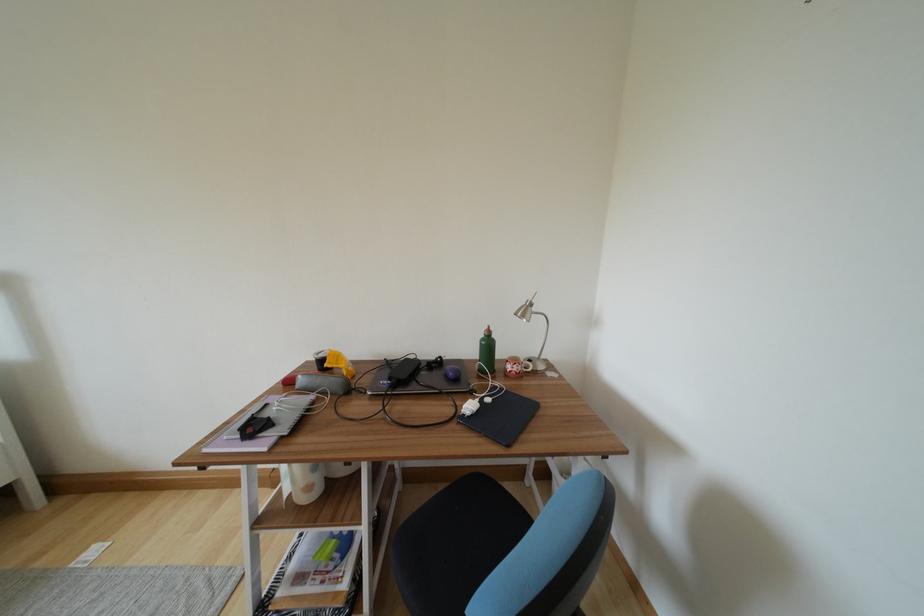
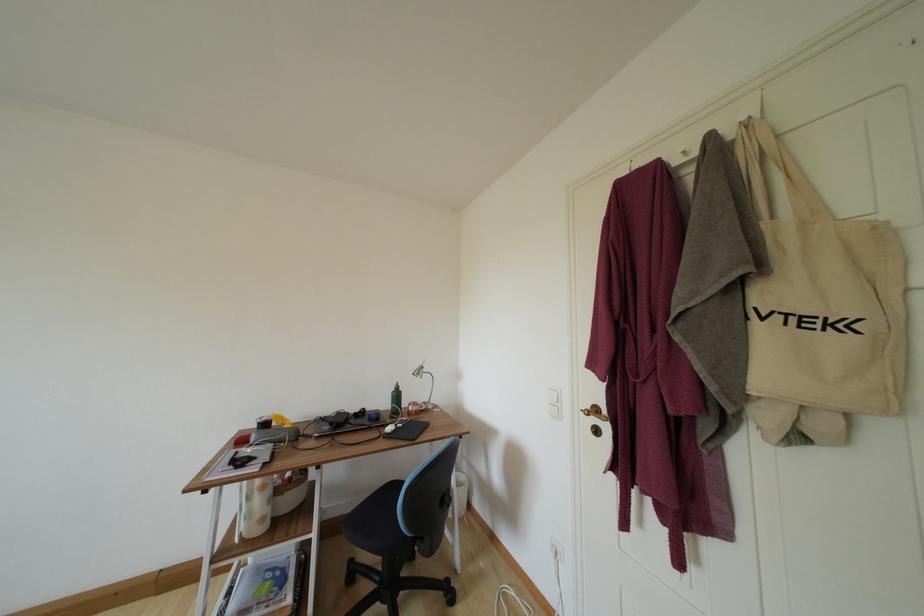
In the second image, find the point that corresponds to point (313, 492) in the first image.

(266, 524)